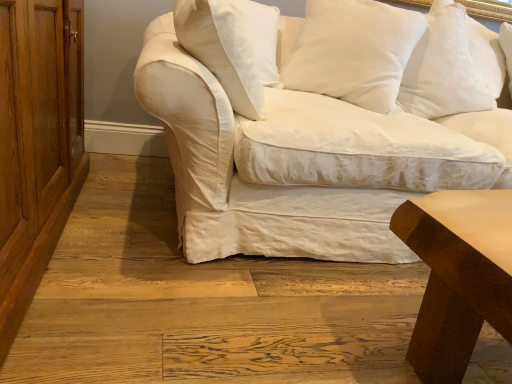
Locate an element on the screen. This screenshot has width=512, height=384. smooth brown wood table at lower right is located at coordinates (458, 276).

This screenshot has width=512, height=384. What do you see at coordinates (487, 55) in the screenshot? I see `white cotton pillow at upper right, the 4th pillow from the left` at bounding box center [487, 55].

Describe the element at coordinates (320, 129) in the screenshot. The width and height of the screenshot is (512, 384). I see `white cotton couch at center` at that location.

Where is `white cotton pillow at upper right, which appears as the third pillow when viewed from the left`? white cotton pillow at upper right, which appears as the third pillow when viewed from the left is located at coordinates (452, 66).

This screenshot has height=384, width=512. What do you see at coordinates (452, 66) in the screenshot?
I see `white cotton pillow at upper right, which is the second pillow from right to left` at bounding box center [452, 66].

Find the location of a particular element. white cotton pillow at upper center, placed as the second pillow when sorted from left to right is located at coordinates (354, 51).

The image size is (512, 384). What do you see at coordinates (354, 51) in the screenshot?
I see `white cotton pillow at upper center, placed as the second pillow when sorted from left to right` at bounding box center [354, 51].

What are the coordinates of `white cotton pillow at upper center, marked as the first pillow in a left-to-right arrangement` in the screenshot? It's located at (232, 47).

Describe the element at coordinates (37, 143) in the screenshot. I see `wooden dresser at left` at that location.

Locate an element on the screen. The width and height of the screenshot is (512, 384). smooth brown wood table at lower right is located at coordinates (458, 276).

Can you confirm if white cotton pillow at upper center, placed as the second pillow when sorted from left to right, is smaller than wooden dresser at left?

Yes, white cotton pillow at upper center, placed as the second pillow when sorted from left to right, is smaller than wooden dresser at left.

Is white cotton pillow at upper center, placed as the 3th pillow when sorted from right to left, thinner than wooden dresser at left?

Yes, white cotton pillow at upper center, placed as the 3th pillow when sorted from right to left, is thinner than wooden dresser at left.

Image resolution: width=512 pixels, height=384 pixels. In order to click on the 1st pillow above the wooden dresser at left (from the image's perspective) in this screenshot , I will do `click(354, 51)`.

Between white cotton pillow at upper center, placed as the second pillow when sorted from left to right, and wooden dresser at left, which one has more height?

With more height is wooden dresser at left.

Is smooth brown wood table at lower right far from white cotton pillow at upper right, which is the second pillow from right to left?

Absolutely, smooth brown wood table at lower right is distant from white cotton pillow at upper right, which is the second pillow from right to left.

Considering the relative positions of smooth brown wood table at lower right and white cotton pillow at upper right, which is the second pillow from right to left, in the image provided, is smooth brown wood table at lower right behind white cotton pillow at upper right, which is the second pillow from right to left,?

No, smooth brown wood table at lower right is closer to the camera.

Considering the relative positions of smooth brown wood table at lower right and white cotton pillow at upper right, which is the second pillow from right to left, in the image provided, is smooth brown wood table at lower right to the left or to the right of white cotton pillow at upper right, which is the second pillow from right to left,?

smooth brown wood table at lower right is to the left of white cotton pillow at upper right, which is the second pillow from right to left.

Which is less distant, (443,347) or (446,7)?

The point (443,347) is closer to the camera.

Is white cotton pillow at upper right, which appears as the first pillow when viewed from the right, behind white cotton couch at center?

That is True.

Is white cotton pillow at upper right, which appears as the first pillow when viewed from the right, not inside white cotton couch at center?

Actually, white cotton pillow at upper right, which appears as the first pillow when viewed from the right, is at least partially inside white cotton couch at center.

In terms of size, does white cotton pillow at upper right, the 4th pillow from the left, appear bigger or smaller than white cotton couch at center?

Clearly, white cotton pillow at upper right, the 4th pillow from the left, is smaller in size than white cotton couch at center.

Find the location of a particular element. The height and width of the screenshot is (384, 512). studio couch below the white cotton pillow at upper right, which appears as the first pillow when viewed from the right (from the image's perspective) is located at coordinates (320, 129).

Which of these two, smooth brown wood table at lower right or white cotton pillow at upper center, placed as the second pillow when sorted from left to right, is smaller?

With smaller size is white cotton pillow at upper center, placed as the second pillow when sorted from left to right.

Which pillow is the 1st one when counting from the left side of the smooth brown wood table at lower right? Please provide its 2D coordinates.

[(354, 51)]

Which object is wider, smooth brown wood table at lower right or white cotton pillow at upper center, placed as the second pillow when sorted from left to right?

smooth brown wood table at lower right.

Is wooden dresser at left far away from white cotton pillow at upper right, which is the second pillow from right to left?

Yes, wooden dresser at left is far from white cotton pillow at upper right, which is the second pillow from right to left.

Measure the distance from wooden dresser at left to white cotton pillow at upper right, which appears as the third pillow when viewed from the left.

They are 4.86 feet apart.

From a real-world perspective, is wooden dresser at left physically below white cotton pillow at upper right, which is the second pillow from right to left?

Yes, from a real-world perspective, wooden dresser at left is beneath white cotton pillow at upper right, which is the second pillow from right to left.

Can you confirm if wooden dresser at left is smaller than white cotton pillow at upper right, which is the second pillow from right to left?

No, wooden dresser at left is not smaller than white cotton pillow at upper right, which is the second pillow from right to left.

Can we say white cotton pillow at upper center, placed as the second pillow when sorted from left to right, lies outside white cotton pillow at upper center, which appears as the fourth pillow when viewed from the right?

That's correct, white cotton pillow at upper center, placed as the second pillow when sorted from left to right, is outside of white cotton pillow at upper center, which appears as the fourth pillow when viewed from the right.

Which is in front, point (327, 93) or point (223, 16)?

Positioned in front is point (223, 16).

In terms of width, does white cotton pillow at upper center, placed as the second pillow when sorted from left to right, look wider or thinner when compared to white cotton pillow at upper center, which appears as the fourth pillow when viewed from the right?

In the image, white cotton pillow at upper center, placed as the second pillow when sorted from left to right, appears to be wider than white cotton pillow at upper center, which appears as the fourth pillow when viewed from the right.

Is white cotton pillow at upper center, marked as the first pillow in a left-to-right arrangement, at the back of white cotton pillow at upper center, placed as the second pillow when sorted from left to right?

white cotton pillow at upper center, placed as the second pillow when sorted from left to right, does not have its back to white cotton pillow at upper center, marked as the first pillow in a left-to-right arrangement.

Where is `the 1st pillow positioned below the white cotton pillow at upper right, which is the second pillow from right to left (from the image's perspective)`? This screenshot has width=512, height=384. the 1st pillow positioned below the white cotton pillow at upper right, which is the second pillow from right to left (from the image's perspective) is located at coordinates (232, 47).

Is white cotton pillow at upper right, which is the second pillow from right to left, located outside white cotton pillow at upper center, marked as the first pillow in a left-to-right arrangement?

That's correct, white cotton pillow at upper right, which is the second pillow from right to left, is outside of white cotton pillow at upper center, marked as the first pillow in a left-to-right arrangement.

Is white cotton pillow at upper right, which is the second pillow from right to left, turned away from white cotton pillow at upper center, which appears as the fourth pillow when viewed from the right?

No, white cotton pillow at upper right, which is the second pillow from right to left,'s orientation is not away from white cotton pillow at upper center, which appears as the fourth pillow when viewed from the right.

Can you confirm if white cotton pillow at upper right, which is the second pillow from right to left, is positioned to the right of white cotton pillow at upper center, marked as the first pillow in a left-to-right arrangement?

Yes.

From a real-world perspective, count 2nd pillows upward from the wooden dresser at left and point to it. Please provide its 2D coordinates.

[(354, 51)]

The width and height of the screenshot is (512, 384). What are the coordinates of `the 3rd pillow positioned above the smooth brown wood table at lower right (from the image's perspective)` in the screenshot? It's located at pos(452,66).

When comparing their distances from smooth brown wood table at lower right, does white cotton couch at center or white cotton pillow at upper center, placed as the second pillow when sorted from left to right, seem further?

Based on the image, white cotton pillow at upper center, placed as the second pillow when sorted from left to right, appears to be further to smooth brown wood table at lower right.

Estimate the real-world distances between objects in this image. Which object is closer to smooth brown wood table at lower right, white cotton pillow at upper center, marked as the first pillow in a left-to-right arrangement, or wooden dresser at left?

white cotton pillow at upper center, marked as the first pillow in a left-to-right arrangement, is closer to smooth brown wood table at lower right.

Based on their spatial positions, is wooden dresser at left or white cotton pillow at upper center, placed as the 3th pillow when sorted from right to left, closer to white cotton pillow at upper right, the 4th pillow from the left?

Based on the image, white cotton pillow at upper center, placed as the 3th pillow when sorted from right to left, appears to be nearer to white cotton pillow at upper right, the 4th pillow from the left.

Which object lies nearer to the anchor point white cotton pillow at upper right, which is the second pillow from right to left, white cotton pillow at upper center, placed as the 3th pillow when sorted from right to left, or white cotton pillow at upper center, which appears as the fourth pillow when viewed from the right?

white cotton pillow at upper center, placed as the 3th pillow when sorted from right to left.

From the image, which object appears to be farther from white cotton pillow at upper center, placed as the 3th pillow when sorted from right to left, wooden dresser at left or white cotton pillow at upper right, the 4th pillow from the left?

wooden dresser at left lies further to white cotton pillow at upper center, placed as the 3th pillow when sorted from right to left, than the other object.

Estimate the real-world distances between objects in this image. Which object is further from white cotton pillow at upper center, placed as the second pillow when sorted from left to right, smooth brown wood table at lower right or wooden dresser at left?

wooden dresser at left is positioned further to the anchor white cotton pillow at upper center, placed as the second pillow when sorted from left to right.

From the picture: Considering their positions, is white cotton pillow at upper right, which is the second pillow from right to left, positioned closer to white cotton pillow at upper right, which appears as the first pillow when viewed from the right, than wooden dresser at left?

white cotton pillow at upper right, which is the second pillow from right to left, is closer to white cotton pillow at upper right, which appears as the first pillow when viewed from the right.

When comparing their distances from smooth brown wood table at lower right, does wooden dresser at left or white cotton pillow at upper right, which appears as the first pillow when viewed from the right, seem closer?

Among the two, wooden dresser at left is located nearer to smooth brown wood table at lower right.

Find the location of a particular element. studio couch located between smooth brown wood table at lower right and white cotton pillow at upper right, which appears as the third pillow when viewed from the left, in the depth direction is located at coordinates (320, 129).

You are a GUI agent. You are given a task and a screenshot of the screen. Output one action in this format:
    pyautogui.click(x=<x>, y=<y>)
    Task: Click on the table between wooden dresser at left and white cotton pillow at upper right, which appears as the third pillow when viewed from the left
    The height and width of the screenshot is (384, 512).
    Given the screenshot: What is the action you would take?
    pyautogui.click(x=458, y=276)

The width and height of the screenshot is (512, 384). In order to click on pillow between smooth brown wood table at lower right and white cotton pillow at upper center, marked as the first pillow in a left-to-right arrangement, in the front-back direction in this screenshot , I will do `click(354, 51)`.

Where is `pillow between white cotton pillow at upper center, which appears as the fourth pillow when viewed from the right, and white cotton couch at center, in the horizontal direction`? The width and height of the screenshot is (512, 384). pillow between white cotton pillow at upper center, which appears as the fourth pillow when viewed from the right, and white cotton couch at center, in the horizontal direction is located at coordinates (354, 51).